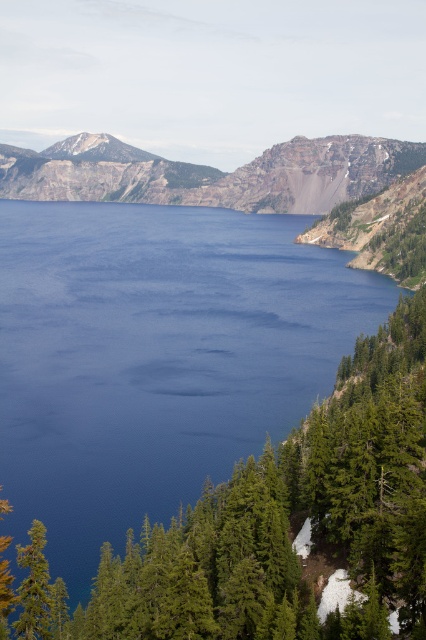
Question: Which of the following is the farthest from the observer?

Choices:
 (A) (137, 365)
 (B) (249, 166)

Answer: (B)

Question: Can you confirm if deep blue water at center is positioned to the right of rugged brown rock at center?

Choices:
 (A) yes
 (B) no

Answer: (A)

Question: Among these points, which one is nearest to the camera?

Choices:
 (A) (55, 192)
 (B) (298, 330)

Answer: (B)

Question: Which object appears closest to the camera in this image?

Choices:
 (A) rugged brown rock at center
 (B) deep blue water at center

Answer: (B)

Question: Can you confirm if deep blue water at center is positioned above rugged brown rock at center?

Choices:
 (A) yes
 (B) no

Answer: (B)

Question: Does deep blue water at center appear on the right side of rugged brown rock at center?

Choices:
 (A) no
 (B) yes

Answer: (B)